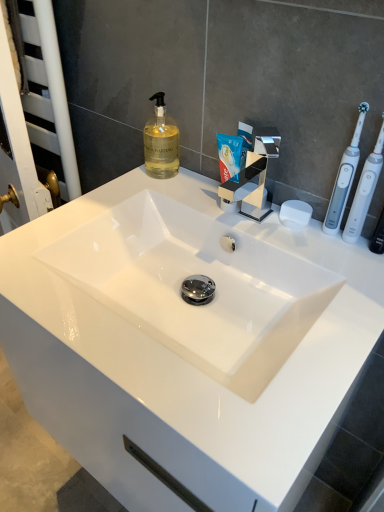
This screenshot has height=512, width=384. What are the coordinates of `free region on the left part of white matte soap at right` in the screenshot? It's located at (226, 210).